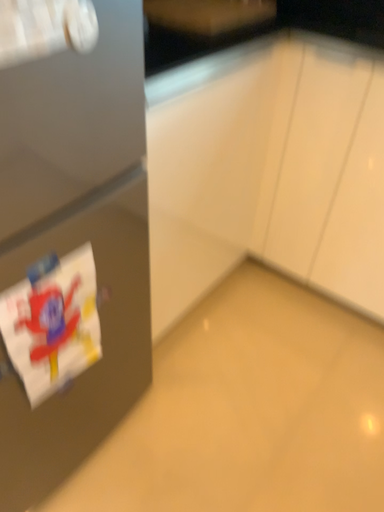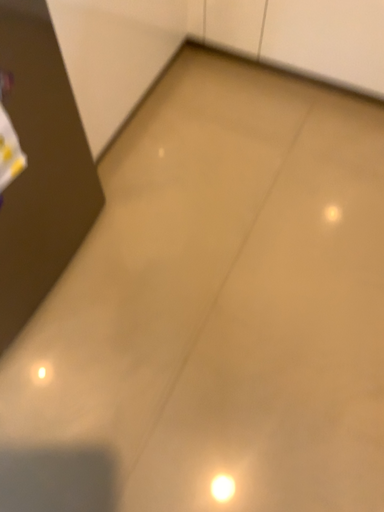
Question: How did the camera likely rotate when shooting the video?

Choices:
 (A) rotated upward
 (B) rotated downward

Answer: (B)